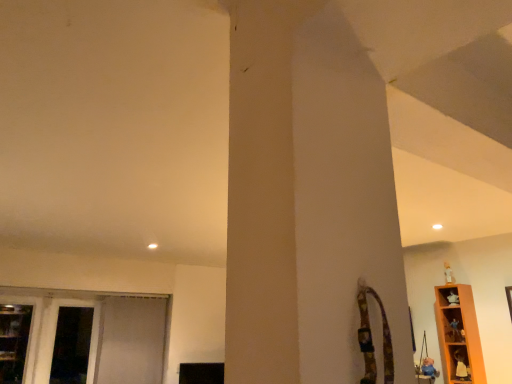
Question: Is orange wood shelf at right, the 1th shelf positioned from the top, smaller than white fabric screen door at left, the second screen door in the right-to-left sequence?

Choices:
 (A) no
 (B) yes

Answer: (B)

Question: Is orange wood shelf at right, the 2th shelf from the bottom, positioned with its back to white fabric screen door at left, which is the 1th screen door in left-to-right order?

Choices:
 (A) yes
 (B) no

Answer: (B)

Question: Is orange wood shelf at right, the 2th shelf from the bottom, in front of white fabric screen door at left, which is the 1th screen door in left-to-right order?

Choices:
 (A) no
 (B) yes

Answer: (B)

Question: Does orange wood shelf at right, the 2th shelf from the bottom, have a lesser width compared to white fabric screen door at left, which is the 1th screen door in left-to-right order?

Choices:
 (A) yes
 (B) no

Answer: (B)

Question: Would you say orange wood shelf at right, the 1th shelf positioned from the top, is outside white fabric screen door at left, which is the 1th screen door in left-to-right order?

Choices:
 (A) no
 (B) yes

Answer: (B)

Question: Can you confirm if orange wood shelf at right, the 1th shelf positioned from the top, is shorter than white fabric screen door at left, the second screen door in the right-to-left sequence?

Choices:
 (A) yes
 (B) no

Answer: (A)

Question: Does white fabric screen door at left, which is the 1th screen door in left-to-right order, come in front of white fabric screen door at lower left, positioned as the second screen door in left-to-right order?

Choices:
 (A) yes
 (B) no

Answer: (A)

Question: Are white fabric screen door at left, the second screen door in the right-to-left sequence, and white fabric screen door at lower left, positioned as the second screen door in left-to-right order, beside each other?

Choices:
 (A) yes
 (B) no

Answer: (B)

Question: Can you confirm if white fabric screen door at left, which is the 1th screen door in left-to-right order, is taller than white fabric screen door at lower left, positioned as the second screen door in left-to-right order?

Choices:
 (A) no
 (B) yes

Answer: (A)

Question: Does white fabric screen door at left, the second screen door in the right-to-left sequence, have a lesser width compared to white fabric screen door at lower left, positioned as the second screen door in left-to-right order?

Choices:
 (A) yes
 (B) no

Answer: (B)

Question: Can you confirm if white fabric screen door at left, which is the 1th screen door in left-to-right order, is positioned to the right of white fabric screen door at lower left, the first screen door when ordered from right to left?

Choices:
 (A) no
 (B) yes

Answer: (A)

Question: From a real-world perspective, is white fabric screen door at left, the second screen door in the right-to-left sequence, positioned over white fabric screen door at lower left, positioned as the second screen door in left-to-right order, based on gravity?

Choices:
 (A) no
 (B) yes

Answer: (A)

Question: Can you confirm if wooden shelf at lower right, which is the first shelf from bottom to top, is wider than white fabric screen door at left, which is the 1th screen door in left-to-right order?

Choices:
 (A) yes
 (B) no

Answer: (B)